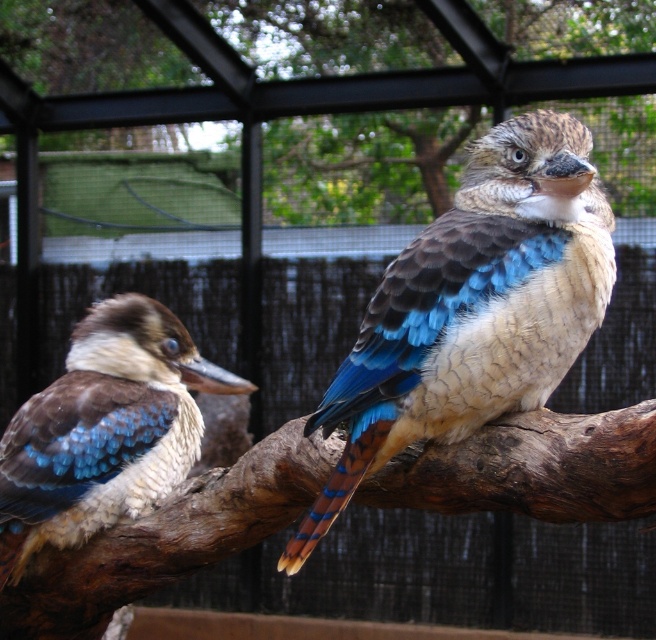
Does brown wood branch at upper center have a lesser height compared to matte brown and blue bird at center?

Incorrect, brown wood branch at upper center's height does not fall short of matte brown and blue bird at center's.

Measure the distance from brown wood branch at upper center to matte brown and blue bird at center.

brown wood branch at upper center is 10.10 feet from matte brown and blue bird at center.

The image size is (656, 640). Describe the element at coordinates (350, 90) in the screenshot. I see `brown wood branch at upper center` at that location.

Find the location of a particular element. brown wood branch at upper center is located at coordinates click(x=350, y=90).

Can you confirm if brown rough wood at center is bigger than matte brown and blue bird at center?

Correct, brown rough wood at center is larger in size than matte brown and blue bird at center.

Does point (60, 632) lie in front of point (138, 435)?

No, it is not.

This screenshot has height=640, width=656. Find the location of `brown rough wood at center`. brown rough wood at center is located at coordinates (171, 538).

Is brown wood branch at upper center smaller than blue feathered bird at center?

Actually, brown wood branch at upper center might be larger than blue feathered bird at center.

Is point (367, 128) closer to camera compared to point (459, 280)?

No, it is behind (459, 280).

At what (x,y) coordinates should I click in order to perform the action: click on brown wood branch at upper center. Please return your answer as a coordinate pair (x, y). This screenshot has width=656, height=640. Looking at the image, I should click on (350, 90).